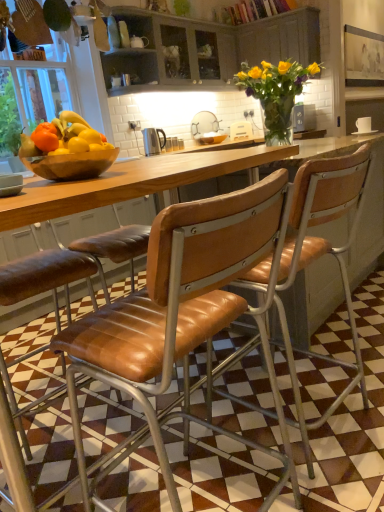
Find the location of a particular element. The height and width of the screenshot is (512, 384). white ceramic sink at center is located at coordinates (207, 129).

Locate an element on the screen. This screenshot has height=512, width=384. brown leather chair at center, the first chair positioned from the left is located at coordinates (184, 320).

Would you consider matte brown bowl at center, the 1th bowl viewed from the back, to be distant from brown leather chair at center, the second chair viewed from the right?

Yes, matte brown bowl at center, the 1th bowl viewed from the back, and brown leather chair at center, the second chair viewed from the right, are quite far apart.

Is matte brown bowl at center, the second bowl in the left-to-right sequence, positioned behind brown leather chair at center, the first chair positioned from the left?

That is True.

From the image's perspective, is matte brown bowl at center, marked as the 1th bowl in a right-to-left arrangement, located above or below brown leather chair at center, the second chair viewed from the right?

matte brown bowl at center, marked as the 1th bowl in a right-to-left arrangement, is situated higher than brown leather chair at center, the second chair viewed from the right, in the image.

Which is in front, point (198, 141) or point (209, 402)?

The point (209, 402) is closer.

Where is `bowl above the satin silver kettle at center (from the image's perspective)`? The image size is (384, 512). bowl above the satin silver kettle at center (from the image's perspective) is located at coordinates (212, 138).

From a real-world perspective, relative to matte brown bowl at center, marked as the 1th bowl in a right-to-left arrangement, is satin silver kettle at center vertically above or below?

From a real-world perspective, satin silver kettle at center is physically above matte brown bowl at center, marked as the 1th bowl in a right-to-left arrangement.

From the image's perspective, is satin silver kettle at center located above matte brown bowl at center, the second bowl from the front?

Incorrect, from the image's perspective, satin silver kettle at center is lower than matte brown bowl at center, the second bowl from the front.

Based on the photo, could you tell me if satin silver kettle at center is turned towards matte brown bowl at center, placed as the 2th bowl when sorted from bottom to top?

No, satin silver kettle at center is not facing towards matte brown bowl at center, placed as the 2th bowl when sorted from bottom to top.

Who is shorter, white ceramic sink at center or matte gray cabinet at upper center, placed as the 2th cabinetry when sorted from right to left?

white ceramic sink at center.

Which of these two, white ceramic sink at center or matte gray cabinet at upper center, placed as the 2th cabinetry when sorted from right to left, is smaller?

Answer: white ceramic sink at center.

Is point (246, 136) farther from viewer compared to point (132, 88)?

Yes, it is behind point (132, 88).

From a real-world perspective, who is located higher, white ceramic sink at center or matte gray cabinet at upper center, placed as the 2th cabinetry when sorted from right to left?

matte gray cabinet at upper center, placed as the 2th cabinetry when sorted from right to left.

Considering the sizes of objects wooden bowl at left and brown leather chair at center, the second chair viewed from the right, in the image provided, who is taller, wooden bowl at left or brown leather chair at center, the second chair viewed from the right,?

Standing taller between the two is wooden bowl at left.

In the image, is wooden bowl at left positioned in front of or behind brown leather chair at center, the second chair viewed from the right?

In the image, wooden bowl at left appears behind brown leather chair at center, the second chair viewed from the right.

From the picture: From the image's perspective, is wooden bowl at left above brown leather chair at center, the second chair viewed from the right?

Correct, wooden bowl at left appears higher than brown leather chair at center, the second chair viewed from the right, in the image.

How much distance is there between wooden bowl at left and brown leather chair at center, the second chair viewed from the right?

wooden bowl at left and brown leather chair at center, the second chair viewed from the right, are 2.77 meters apart from each other.

Is the depth of leather seat at center, the 1th chair when ordered from right to left, greater than that of wooden bowl at left?

That is False.

Which object is positioned more to the right, leather seat at center, acting as the second chair starting from the left, or wooden bowl at left?

leather seat at center, acting as the second chair starting from the left.

Do you think leather seat at center, acting as the second chair starting from the left, is within wooden bowl at left, or outside of it?

leather seat at center, acting as the second chair starting from the left, cannot be found inside wooden bowl at left.

Considering the sizes of objects leather seat at center, the 1th chair when ordered from right to left, and wooden bowl at left in the image provided, who is thinner, leather seat at center, the 1th chair when ordered from right to left, or wooden bowl at left?

Thinner between the two is wooden bowl at left.

Looking at the image, does wooden bowl at left seem bigger or smaller compared to leather seat at center, the 1th chair when ordered from right to left?

In the image, wooden bowl at left appears to be larger than leather seat at center, the 1th chair when ordered from right to left.

Is there a large distance between wooden bowl at left and leather seat at center, the 1th chair when ordered from right to left?

Yes, wooden bowl at left is far from leather seat at center, the 1th chair when ordered from right to left.

From a real-world perspective, between wooden bowl at left and leather seat at center, the 1th chair when ordered from right to left, who is vertically higher?

In real-world perspective, wooden bowl at left is above.

Considering the sizes of objects wooden bowl at left and leather seat at center, the 1th chair when ordered from right to left, in the image provided, who is thinner, wooden bowl at left or leather seat at center, the 1th chair when ordered from right to left,?

With smaller width is wooden bowl at left.

Is white ceramic sink at center spatially inside brown leather chair at center, the first chair positioned from the left, or outside of it?

The correct answer is: outside.

Is white ceramic sink at center not near brown leather chair at center, the second chair viewed from the right?

Yes, white ceramic sink at center and brown leather chair at center, the second chair viewed from the right, are located far from each other.

Which is closer to the camera, (201, 144) or (55, 344)?

Point (201, 144) is farther from the camera than point (55, 344).

Measure the distance from white ceramic sink at center to brown leather chair at center, the first chair positioned from the left.

They are 3.54 meters apart.

From the brown leather chair at center, the first chair positioned from the left, count 2nd bowls backward and point to it. Please provide its 2D coordinates.

[(212, 138)]

The image size is (384, 512). In order to click on bowl located above the satin silver kettle at center (from the image's perspective) in this screenshot , I will do pos(212,138).

When comparing their distances from wooden cabinet at upper center, placed as the 2th cabinetry when sorted from left to right, does white ceramic sink at center or matte gray cabinet at upper center, placed as the 2th cabinetry when sorted from right to left, seem further?

white ceramic sink at center is further to wooden cabinet at upper center, placed as the 2th cabinetry when sorted from left to right.

Based on their spatial positions, is matte brown bowl at center, placed as the 2th bowl when sorted from bottom to top, or matte gray cabinet at upper center, positioned as the 1th cabinetry in left-to-right order, closer to white ceramic sink at center?

matte brown bowl at center, placed as the 2th bowl when sorted from bottom to top, is closer to white ceramic sink at center.

Looking at the image, which one is located closer to leather seat at center, the 1th chair when ordered from right to left, wooden bowl at center, which is the 1th bowl from left to right, or brown leather chair at center, the second chair viewed from the right?

Based on the image, brown leather chair at center, the second chair viewed from the right, appears to be nearer to leather seat at center, the 1th chair when ordered from right to left.

Considering their positions, is brown leather chair at center, the second chair viewed from the right, positioned closer to white ceramic sink at center than matte gray cabinet at upper center, placed as the 2th cabinetry when sorted from right to left?

matte gray cabinet at upper center, placed as the 2th cabinetry when sorted from right to left, is closer to white ceramic sink at center.

Based on their spatial positions, is brown leather chair at center, the first chair positioned from the left, or wooden bowl at left closer to wooden cabinet at upper center, placed as the 2th cabinetry when sorted from left to right?

Among the two, wooden bowl at left is located nearer to wooden cabinet at upper center, placed as the 2th cabinetry when sorted from left to right.

Looking at this image, considering their positions, is wooden cabinet at upper center, the 1th cabinetry from the right, positioned further to brown leather chair at center, the first chair positioned from the left, than wooden bowl at left?

wooden cabinet at upper center, the 1th cabinetry from the right, is further to brown leather chair at center, the first chair positioned from the left.

From the picture: When comparing their distances from wooden bowl at center, marked as the 1th bowl in a bottom-to-top arrangement, does wooden cabinet at upper center, placed as the 2th cabinetry when sorted from left to right, or brown leather chair at center, the second chair viewed from the right, seem closer?

The object closer to wooden bowl at center, marked as the 1th bowl in a bottom-to-top arrangement, is brown leather chair at center, the second chair viewed from the right.

Which object lies further to the anchor point white ceramic sink at center, matte gray cabinet at upper center, placed as the 2th cabinetry when sorted from right to left, or brown leather chair at center, the first chair positioned from the left?

brown leather chair at center, the first chair positioned from the left, lies further to white ceramic sink at center than the other object.

Locate an element on the screen. The width and height of the screenshot is (384, 512). cabinetry between wooden bowl at left and wooden cabinet at upper center, placed as the 2th cabinetry when sorted from left to right, from left to right is located at coordinates (207, 50).

What are the coordinates of `bowl between brown leather chair at center, the second chair viewed from the right, and wooden cabinet at upper center, placed as the 2th cabinetry when sorted from left to right, along the z-axis` in the screenshot? It's located at (72, 165).

The image size is (384, 512). Identify the location of cabinetry between wooden bowl at center, which appears as the 2th bowl when viewed from the back, and wooden cabinet at upper center, the 1th cabinetry from the right, along the z-axis. (207, 50).

I want to click on chair between brown leather chair at center, the first chair positioned from the left, and matte gray cabinet at upper center, positioned as the 1th cabinetry in left-to-right order, in the front-back direction, so click(x=320, y=257).